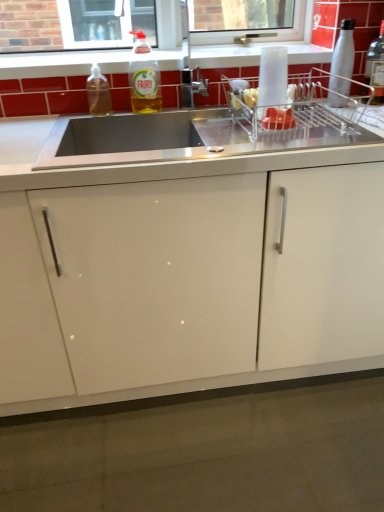
Find the location of a particular element. free space to the left of translucent plastic bottle at upper center, which is the 3th bottle from right to left is located at coordinates (104, 115).